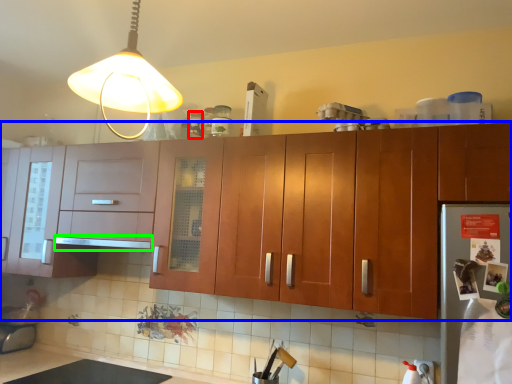
Question: Which object is positioned closest to bottle (highlighted by a red box)? Select from cabinetry (highlighted by a blue box) and exhaust hood (highlighted by a green box).

Choices:
 (A) cabinetry
 (B) exhaust hood

Answer: (B)